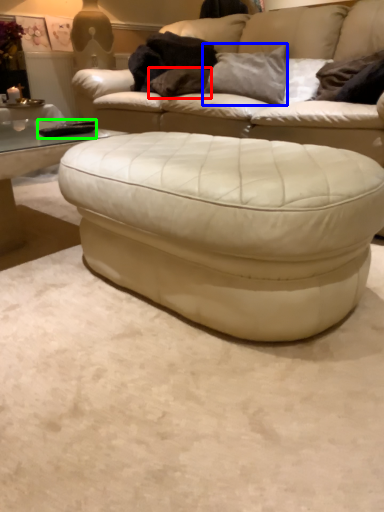
Question: Based on their relative distances, which object is nearer to pillow (highlighted by a red box)? Choose from pillow (highlighted by a blue box) and pad (highlighted by a green box).

Choices:
 (A) pillow
 (B) pad

Answer: (A)